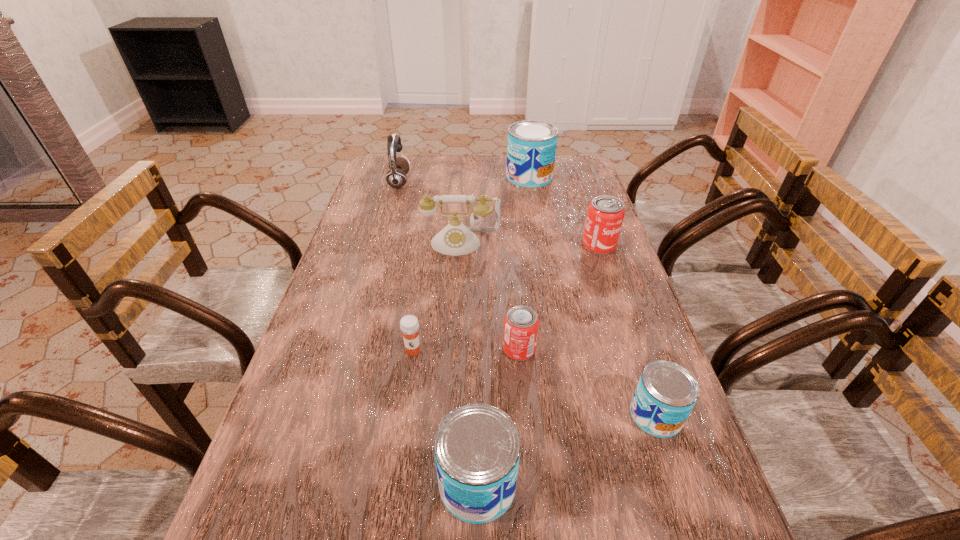
Image resolution: width=960 pixels, height=540 pixels. I want to click on earphone, so click(x=396, y=177).

The height and width of the screenshot is (540, 960). Find the location of `brown earphone`. brown earphone is located at coordinates (396, 177).

Find the location of a particular element. This screenshot has width=960, height=540. the farthest can is located at coordinates (531, 149).

The image size is (960, 540). I want to click on the biggest blue can, so click(531, 149).

The height and width of the screenshot is (540, 960). What are the coordinates of `white telephone` in the screenshot? It's located at (455, 239).

Identify the location of the bigger red can. (605, 214).

Locate an element on the screen. the farther red can is located at coordinates pyautogui.click(x=605, y=214).

Where is `the nearest can`? Image resolution: width=960 pixels, height=540 pixels. the nearest can is located at coordinates (477, 447).

At what (x,y) coordinates should I click in order to perform the action: click on the nearest blue can. Please return your answer as a coordinate pair (x, y). This screenshot has height=540, width=960. Looking at the image, I should click on (477, 447).

Find the location of a particular element. the left red can is located at coordinates (521, 323).